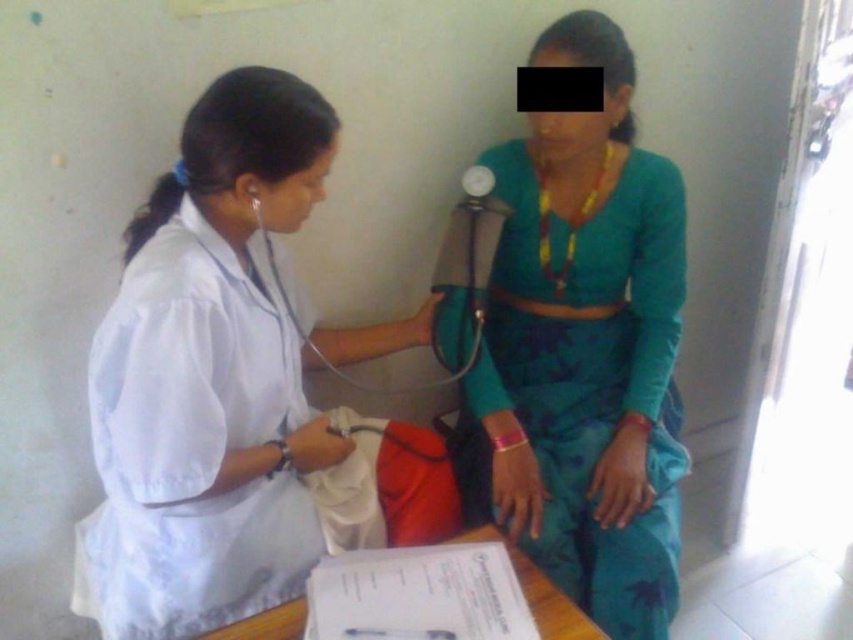
Question: Which point is closer to the camera taking this photo?

Choices:
 (A) (641, 160)
 (B) (163, 250)

Answer: (B)

Question: Among these objects, which one is farthest from the camera?

Choices:
 (A) white matte lab coat at center
 (B) teal fabric dress at center

Answer: (B)

Question: Where is white matte lab coat at center located in relation to teal fabric dress at center in the image?

Choices:
 (A) left
 (B) right

Answer: (A)

Question: Does white matte lab coat at center have a smaller size compared to teal fabric dress at center?

Choices:
 (A) yes
 (B) no

Answer: (B)

Question: Can you confirm if white matte lab coat at center is positioned above teal fabric dress at center?

Choices:
 (A) yes
 (B) no

Answer: (B)

Question: Among these points, which one is nearest to the camera?

Choices:
 (A) (570, 285)
 (B) (352, 429)

Answer: (B)